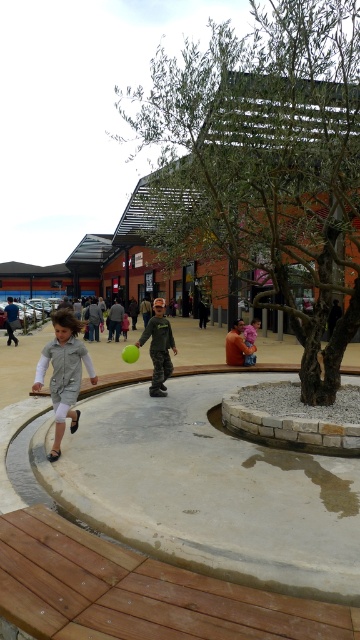
Is green matte shirt at center wider than light gray fabric jacket at center?

Incorrect, green matte shirt at center's width does not surpass light gray fabric jacket at center's.

Does green matte shirt at center have a lesser width compared to light gray fabric jacket at center?

Correct, green matte shirt at center's width is less than light gray fabric jacket at center's.

Who is more distant from viewer, (156, 394) or (245, 358)?

Point (245, 358)

Where is `green matte shirt at center`? green matte shirt at center is located at coordinates (159, 348).

Between point (47, 368) and point (254, 356), which one is positioned in front?

Positioned in front is point (47, 368).

Consider the image. Does light gray fabric jacket at left have a lesser width compared to light gray fabric jacket at center?

Yes.

Image resolution: width=360 pixels, height=640 pixels. I want to click on light gray fabric jacket at left, so click(64, 372).

Who is more forward, (x=60, y=422) or (x=171, y=369)?

Point (x=60, y=422)

Is point (56, 314) positioned after point (155, 388)?

No, (56, 314) is in front of (155, 388).

The height and width of the screenshot is (640, 360). Identify the location of light gray fabric jacket at left. (64, 372).